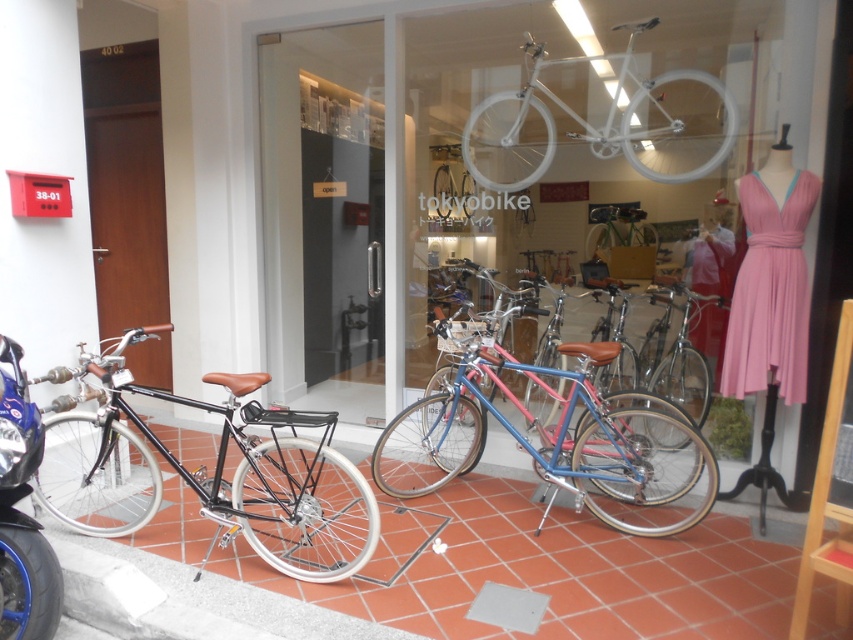
You are a delivery person with a package for the tokyobike shop. You need to place the package on the ground between the terracotta tile pavement at lower center and the blue metallic bicycle at center. Is there enough space to place the package between them?

The terracotta tile pavement at lower center and blue metallic bicycle at center are 16.82 inches apart from each other. Since the package requires some space to be placed between them, the distance of 16.82 inches may be sufficient depending on the package size. However, without knowing the exact dimensions of the package, it is difficult to confirm definitively.

You are a delivery person who needs to park your bike between the blue metallic bicycle at center and the white matte bicycle at upper center. The space between them is exactly 5.12 feet. Your bike is 4.5 feet long. Can you fit your bike in that space?

The blue metallic bicycle at center and white matte bicycle at upper center are 5.12 feet apart from each other. Since your bike is 4.5 feet long, which is shorter than the available space, you can fit your bike between them.

You are a customer at the tokyobike shop and want to choose a bicycle that is shorter in height. Which bicycle between the matte black bicycle at left and the blue metallic bicycle at center should you pick?

The matte black bicycle at left has a lesser height compared to the blue metallic bicycle at center, so you should pick the matte black bicycle at left.